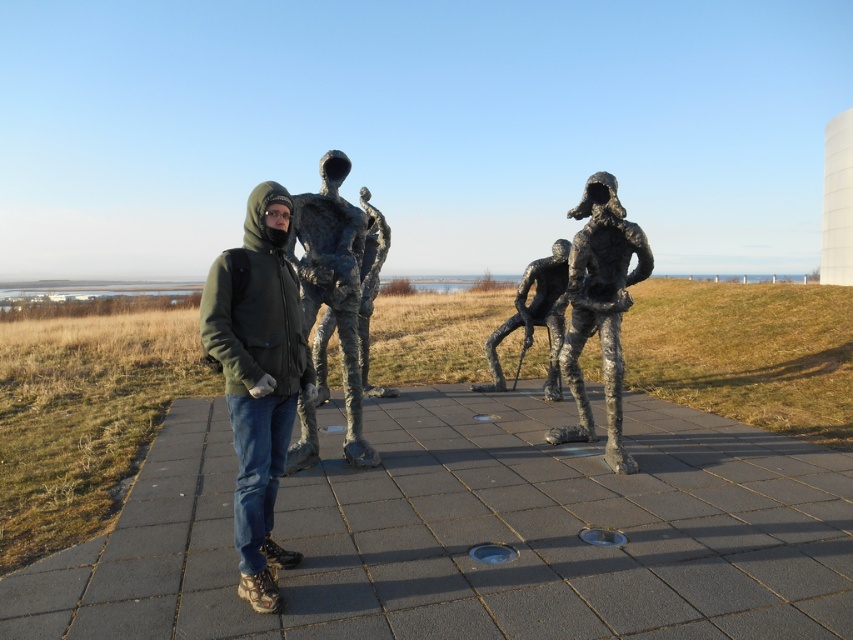
You are a photographer planning to capture a wide shot of the entire scene. Given that the green matte jacket at center and the bronze textured figure at center are both in the frame, which object will appear smaller in the photograph?

The green matte jacket at center will appear smaller in the photograph because it occupies less space than the bronze textured figure at center according to the description.